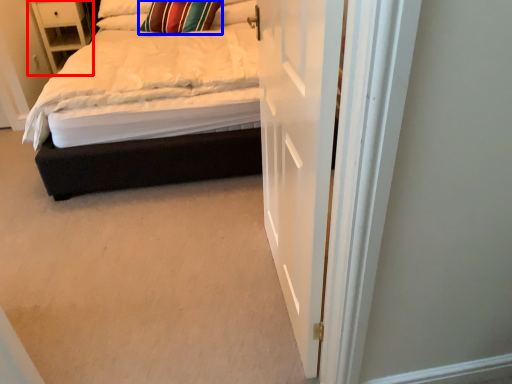
Question: Which object is closer to the camera taking this photo, nightstand (highlighted by a red box) or pillow (highlighted by a blue box)?

Choices:
 (A) nightstand
 (B) pillow

Answer: (B)